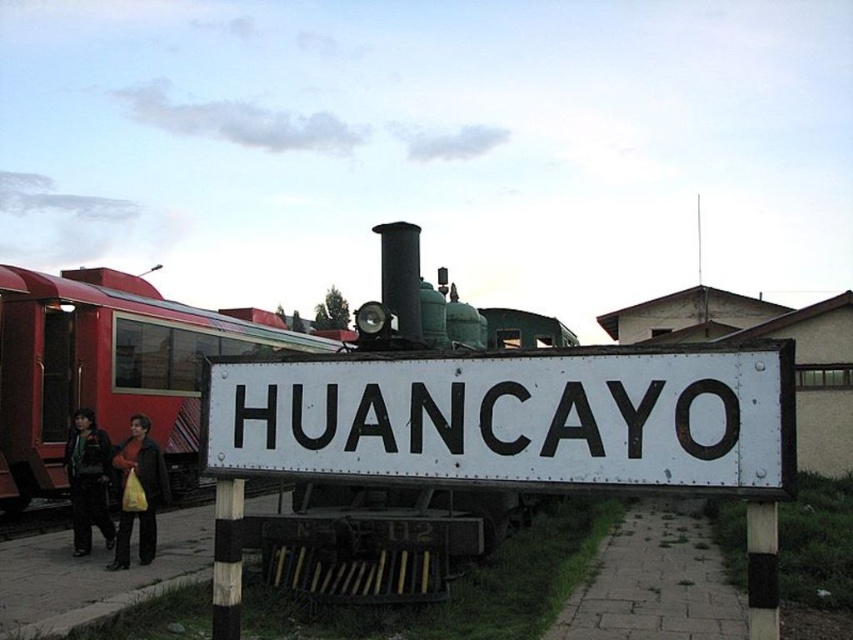
You are a photographer trying to capture both the white metal signboard at center and the dark green jacket at left in a single shot. Based on their sizes in the image, which object would require you to adjust your camera angle more to ensure both are fully visible?

The white metal signboard at center might be wider than dark green jacket at left, so you might need to adjust your camera angle more to include the entire white metal signboard at center in the frame.

You are a photographer standing in front of the HUANCAYO signboard. You want to take a photo that includes both the red painted metal train car at left and the dark green jacket at left. Which object should you focus on first if you want to ensure both are in the frame without moving the camera?

The red painted metal train car at left is bigger than the dark green jacket at left, so you should focus on the red painted metal train car at left first since it requires more space in the frame.

You are a passenger waiting at the station and see the red painted metal train car at left and the dark green jacket at left. Which object is positioned higher in the scene?

The red painted metal train car at left is located above the dark green jacket at left, so it is positioned higher in the scene.